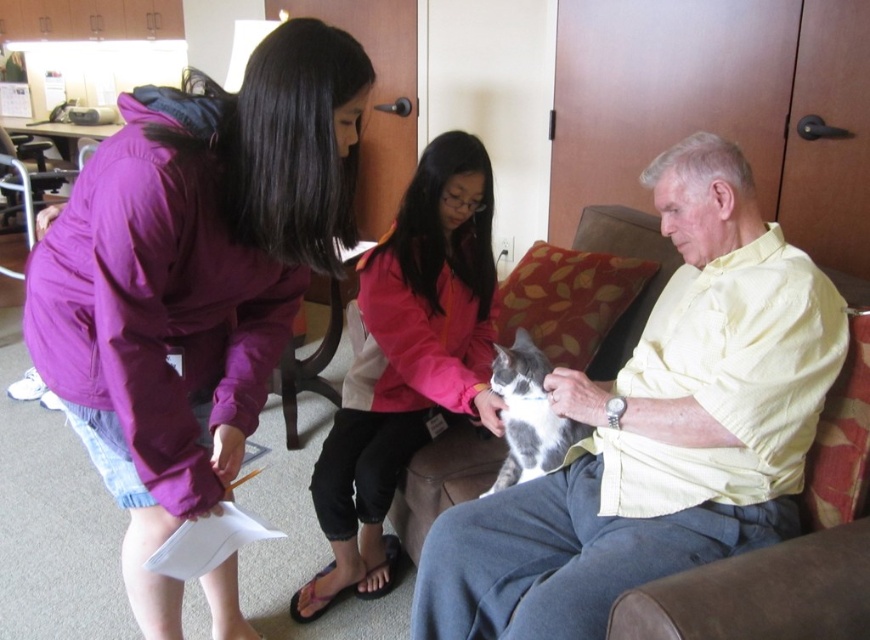
You are a photographer positioned in the room and want to capture a clear photo of both the purple fabric jacket at upper left and the pink fabric jacket at center. Which jacket will appear larger in the photo?

The purple fabric jacket at upper left will appear larger in the photo because it is closer to the viewer than the pink fabric jacket at center.

In the scene shown: You are organizing a clothing donation drive and need to determine if the purple fabric jacket at upper left and the pink fabric jacket at center can fit into a standard donation box that accommodates items up to 30 inches in length. Given their sizes, will both jackets fit?

The purple fabric jacket at upper left is larger in size compared to the pink fabric jacket at center. However, the exact dimensions of both jackets are not provided. Assuming the larger jacket is under 30 inches, both could fit, but this requires measuring them first.